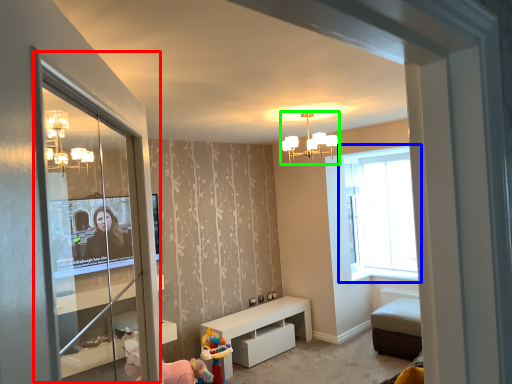
Question: Based on their relative distances, which object is nearer to screen door (highlighted by a red box)? Choose from window (highlighted by a blue box) and light fixture (highlighted by a green box).

Choices:
 (A) window
 (B) light fixture

Answer: (B)